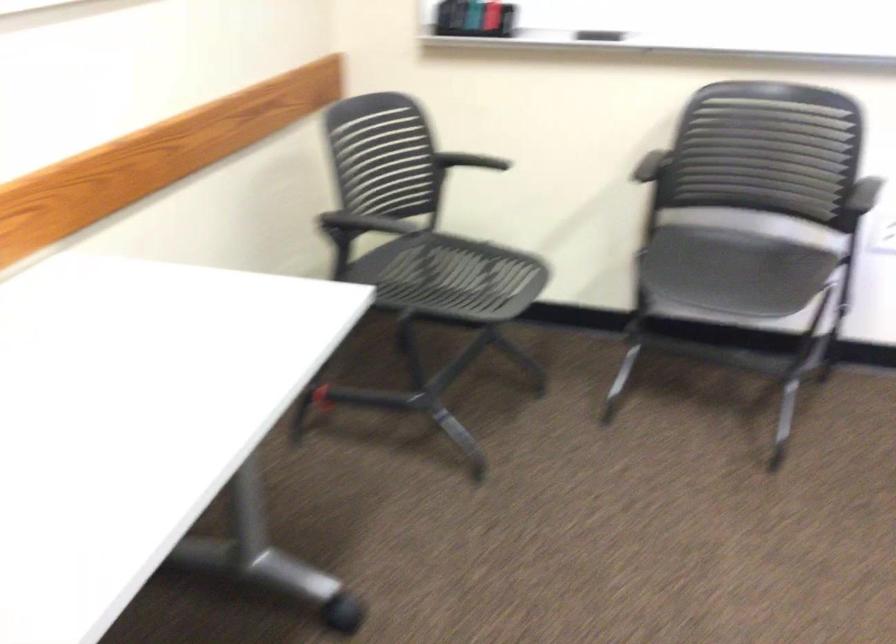
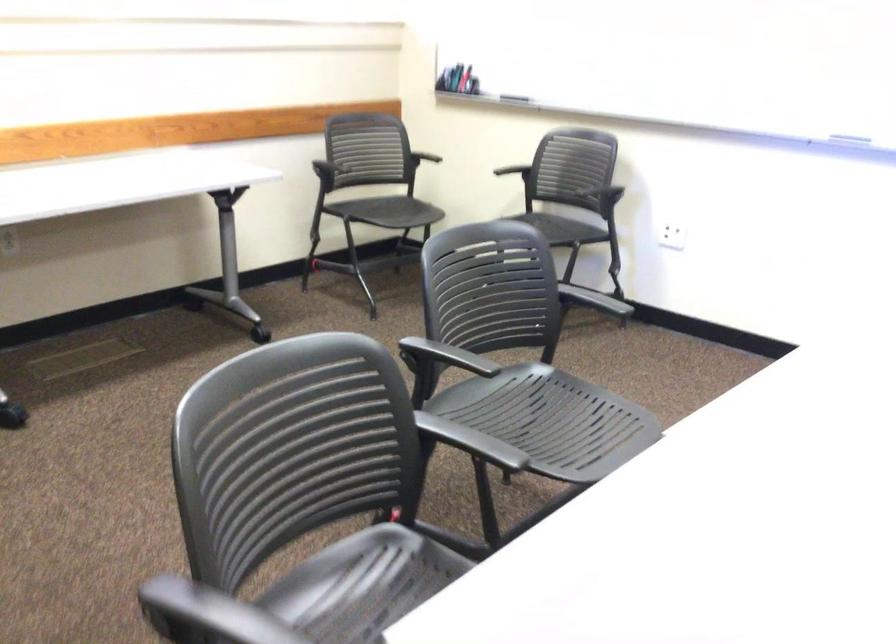
Where in the second image is the point corresponding to the point at 649,166 from the first image?

(513, 162)